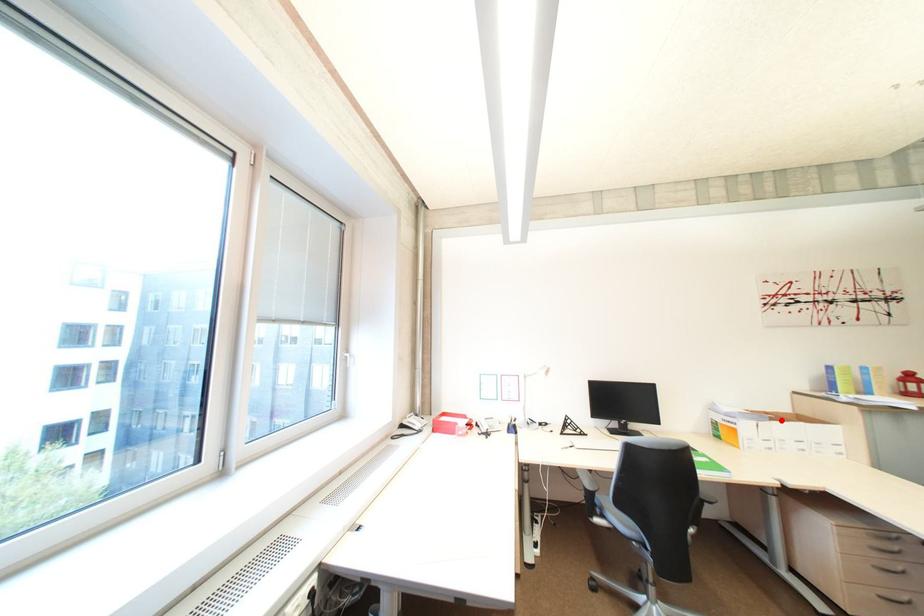
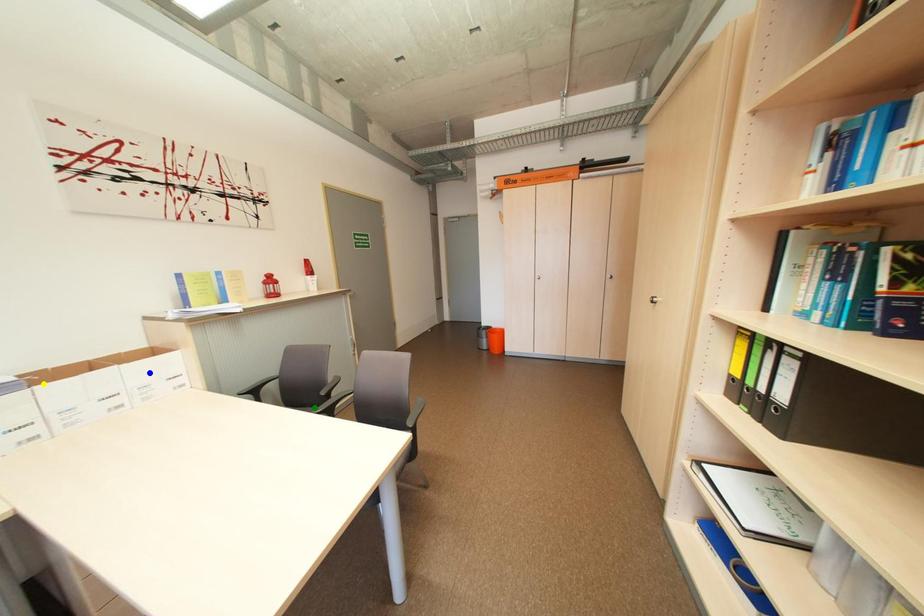
Question: I am providing you with two images of the same scene from different viewpoints. A red point is marked on the first image. You are given multiple points on the second image. Can you choose the point in image 2 that corresponds to the point in image 1?

Choices:
 (A) yellow point
 (B) blue point
 (C) green point

Answer: (A)